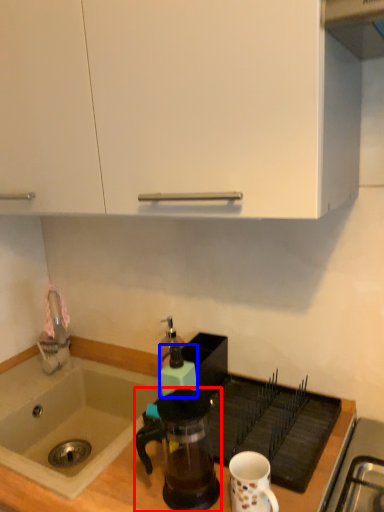
Question: Which object is further to the camera taking this photo, coffee maker (highlighted by a red box) or kitchen appliance (highlighted by a blue box)?

Choices:
 (A) coffee maker
 (B) kitchen appliance

Answer: (B)